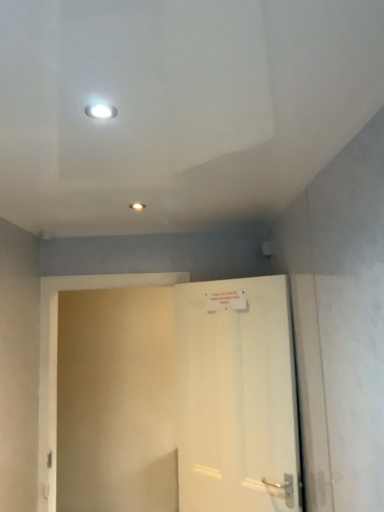
This screenshot has width=384, height=512. Identify the location of white matte door at center. (236, 396).

The image size is (384, 512). Describe the element at coordinates (236, 396) in the screenshot. I see `white matte door at center` at that location.

The height and width of the screenshot is (512, 384). What do you see at coordinates (101, 111) in the screenshot?
I see `white glossy light fixture at upper center` at bounding box center [101, 111].

Locate an element on the screen. white glossy light fixture at upper center is located at coordinates [101, 111].

I want to click on white matte door at center, so click(236, 396).

Considering the relative positions of white glossy light fixture at upper center and white matte door at center in the image provided, is white glossy light fixture at upper center to the right of white matte door at center from the viewer's perspective?

No.

Considering the relative positions of white glossy light fixture at upper center and white matte door at center in the image provided, is white glossy light fixture at upper center in front of white matte door at center?

Yes, white glossy light fixture at upper center is closer to the camera.

Based on the photo, which is farther from the camera, (101, 117) or (296, 497)?

The point (296, 497) is farther from the camera.

From the image's perspective, is white glossy light fixture at upper center located above or below white matte door at center?

white glossy light fixture at upper center is situated higher than white matte door at center in the image.

From a real-world perspective, which object stands above the other?

From a 3D spatial view, white glossy light fixture at upper center is above.

In the scene shown: Between white glossy light fixture at upper center and white matte door at center, which one has smaller width?

white glossy light fixture at upper center.

From the picture: Considering the sizes of objects white glossy light fixture at upper center and white matte door at center in the image provided, who is taller, white glossy light fixture at upper center or white matte door at center?

white matte door at center.

Is white glossy light fixture at upper center bigger than white matte door at center?

No.

Would you say white glossy light fixture at upper center is inside or outside white matte door at center?

white glossy light fixture at upper center is not enclosed by white matte door at center.

Is white glossy light fixture at upper center next to white matte door at center?

There is a gap between white glossy light fixture at upper center and white matte door at center.

Is white glossy light fixture at upper center looking in the opposite direction of white matte door at center?

No.

How many degrees apart are the facing directions of white glossy light fixture at upper center and white matte door at center?

white glossy light fixture at upper center and white matte door at center are facing 134 degrees away from each other.

What are the coordinates of `lighting above the white matte door at center (from a real-world perspective)` in the screenshot? It's located at (101, 111).

Visually, is white matte door at center positioned to the left or to the right of white glossy light fixture at upper center?

Based on their positions, white matte door at center is located to the right of white glossy light fixture at upper center.

Which is in front, white matte door at center or white glossy light fixture at upper center?

white glossy light fixture at upper center.

Between point (295, 489) and point (99, 114), which one is positioned in front?

The point (99, 114) is closer.

From the image's perspective, is white matte door at center over white glossy light fixture at upper center?

No, from the image's perspective, white matte door at center is not above white glossy light fixture at upper center.

From the picture: From a real-world perspective, does white matte door at center stand above white glossy light fixture at upper center?

No, from a real-world perspective, white matte door at center is not above white glossy light fixture at upper center.

Does white matte door at center have a lesser width compared to white glossy light fixture at upper center?

Incorrect, the width of white matte door at center is not less than that of white glossy light fixture at upper center.

In terms of height, does white matte door at center look taller or shorter compared to white glossy light fixture at upper center?

In the image, white matte door at center appears to be taller than white glossy light fixture at upper center.

Is white matte door at center bigger than white glossy light fixture at upper center?

A: Yes, white matte door at center is bigger than white glossy light fixture at upper center.

Is white matte door at center inside or outside of white glossy light fixture at upper center?

white matte door at center is outside white glossy light fixture at upper center.

Is white matte door at center with white glossy light fixture at upper center?

white matte door at center is not next to white glossy light fixture at upper center, and they're not touching.

Is white matte door at center facing towards white glossy light fixture at upper center?

Yes, white matte door at center is turned towards white glossy light fixture at upper center.

Measure the distance between white matte door at center and white glossy light fixture at upper center.

They are 5.76 feet apart.

Find the location of `door below the white glossy light fixture at upper center (from the image's perspective)`. door below the white glossy light fixture at upper center (from the image's perspective) is located at coordinates (236, 396).

Identify the location of door that is behind the white glossy light fixture at upper center. The width and height of the screenshot is (384, 512). (236, 396).

Where is `lighting that is above the white matte door at center (from the image's perspective)`? Image resolution: width=384 pixels, height=512 pixels. lighting that is above the white matte door at center (from the image's perspective) is located at coordinates (101, 111).